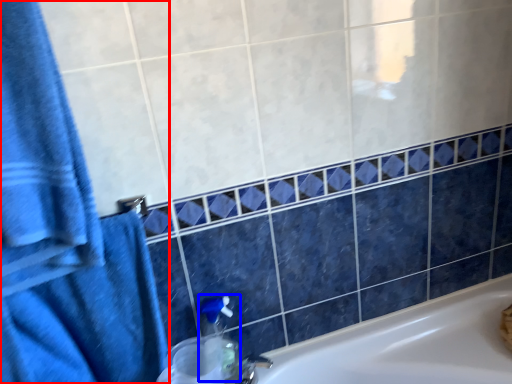
Question: Which object appears closest to the camera in this image, bath towel (highlighted by a red box) or soap dispenser (highlighted by a blue box)?

Choices:
 (A) bath towel
 (B) soap dispenser

Answer: (A)